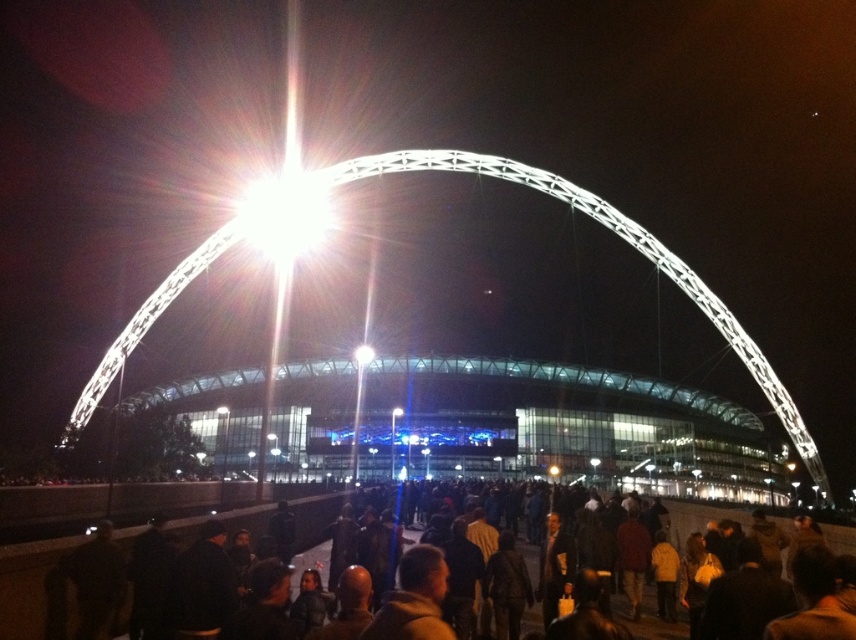
Who is more forward, (123, 486) or (328, 211)?

Point (123, 486)

Can you confirm if dark brown clothing at lower center is positioned below bright white light at center?

Yes.

Identify the location of dark brown clothing at lower center. This screenshot has width=856, height=640. (42, 589).

This screenshot has width=856, height=640. Identify the location of dark brown clothing at lower center. (42, 589).